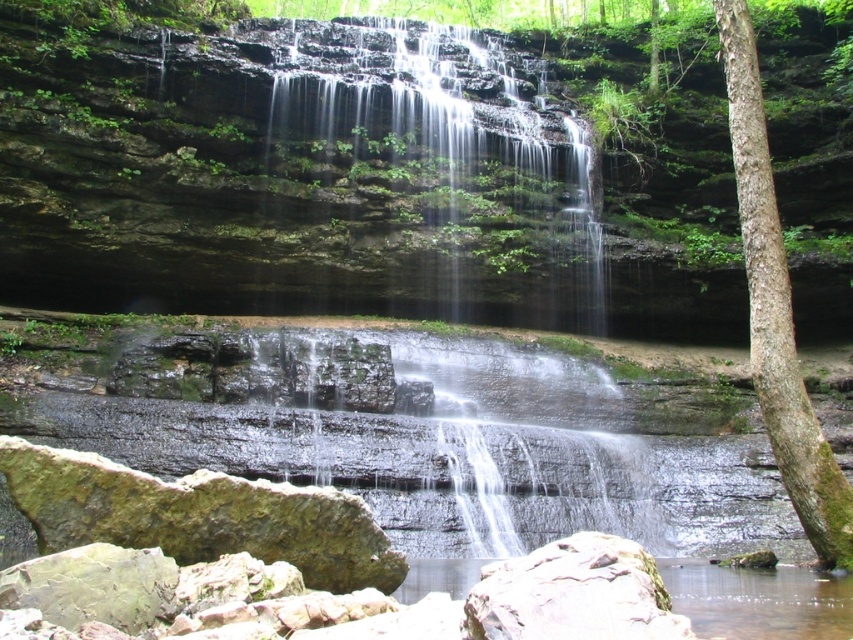
Question: Estimate the real-world distances between objects in this image. Which object is closer to the green rough bark tree at right?

Choices:
 (A) translucent rock waterfall at center
 (B) smooth gray rock at lower center

Answer: (A)

Question: Which object is the farthest from the smooth gray rock at lower center?

Choices:
 (A) green rough bark tree at right
 (B) translucent rock waterfall at center

Answer: (B)

Question: Among these points, which one is nearest to the camera?

Choices:
 (A) (492, 604)
 (B) (778, 256)
 (C) (457, 177)

Answer: (A)

Question: Does green rough bark tree at right have a greater width compared to smooth gray rock at lower center?

Choices:
 (A) no
 (B) yes

Answer: (B)

Question: Can you confirm if translucent rock waterfall at center is positioned to the right of green rough bark tree at right?

Choices:
 (A) yes
 (B) no

Answer: (B)

Question: Does translucent rock waterfall at center appear over smooth gray rock at lower center?

Choices:
 (A) yes
 (B) no

Answer: (A)